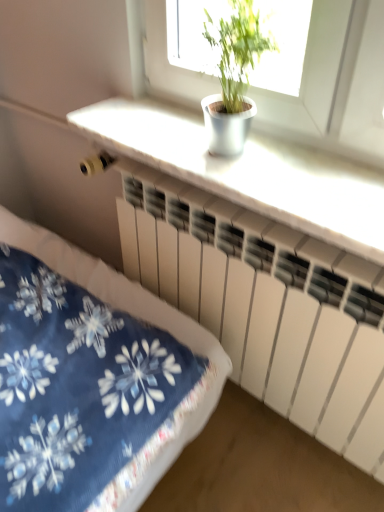
Find the location of a particular element. Image resolution: width=384 pixels, height=512 pixels. free spot in front of green leafy plant at upper center is located at coordinates (273, 200).